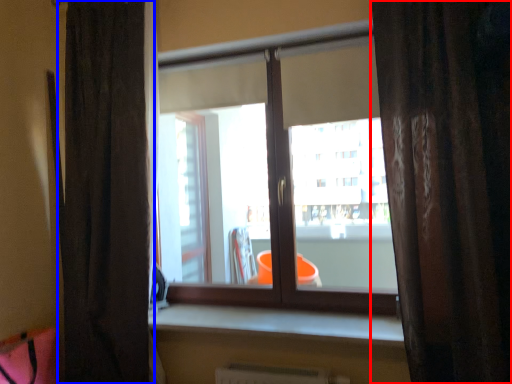
Question: Among these objects, which one is farthest to the camera, curtain (highlighted by a red box) or curtain (highlighted by a blue box)?

Choices:
 (A) curtain
 (B) curtain

Answer: (B)